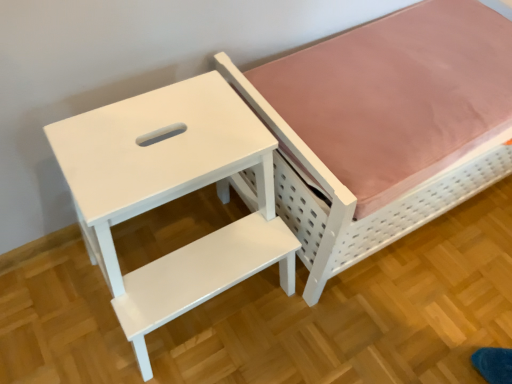
This screenshot has width=512, height=384. In order to click on vacant space situated on the left part of white glossy step stool at upper left in this screenshot , I will do `click(75, 302)`.